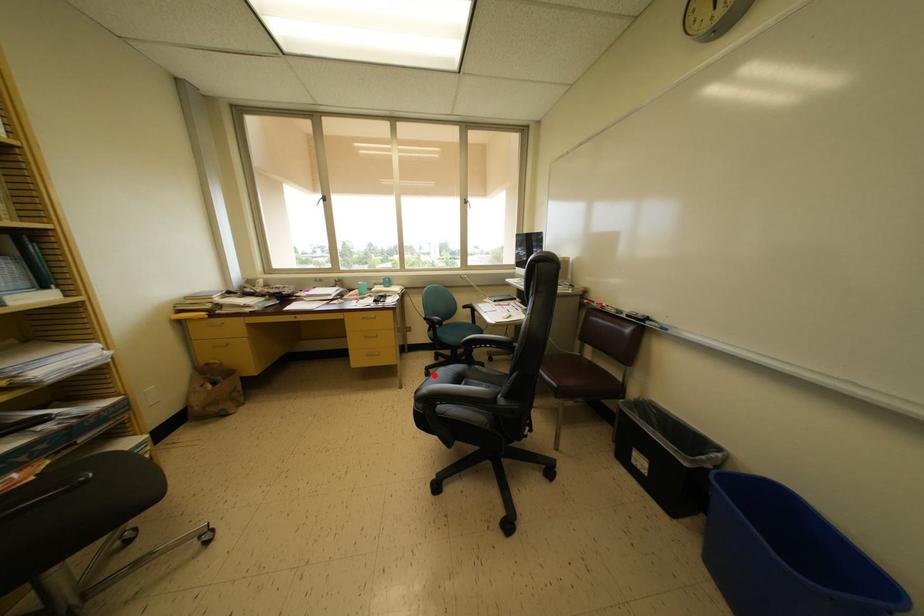
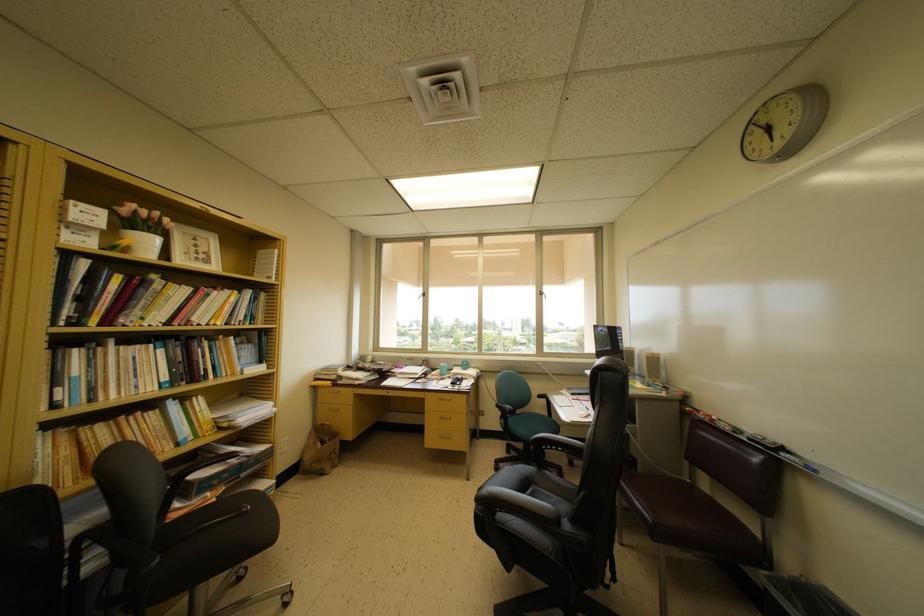
The point at the highlighted location is marked in the first image. Where is the corresponding point in the second image?

(504, 469)